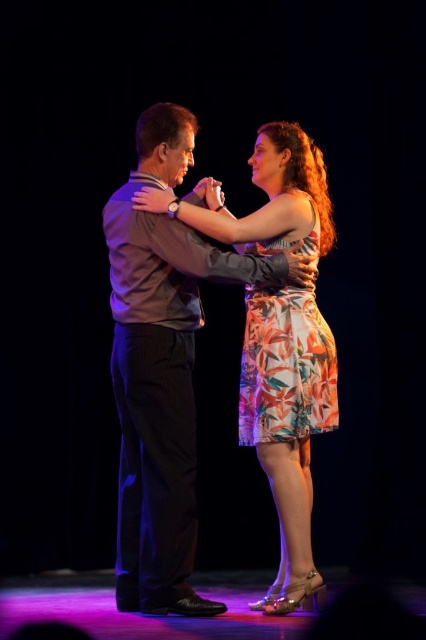
Question: Is floral dress at center closer to camera compared to floral print dress at center?

Choices:
 (A) yes
 (B) no

Answer: (A)

Question: Which object appears closest to the camera in this image?

Choices:
 (A) floral print dress at center
 (B) floral dress at center

Answer: (B)

Question: Which point is farther to the camera?

Choices:
 (A) (255, 390)
 (B) (282, 170)

Answer: (B)

Question: Is the position of floral dress at center more distant than that of floral print dress at center?

Choices:
 (A) no
 (B) yes

Answer: (A)

Question: Can you confirm if floral dress at center is smaller than floral print dress at center?

Choices:
 (A) yes
 (B) no

Answer: (B)